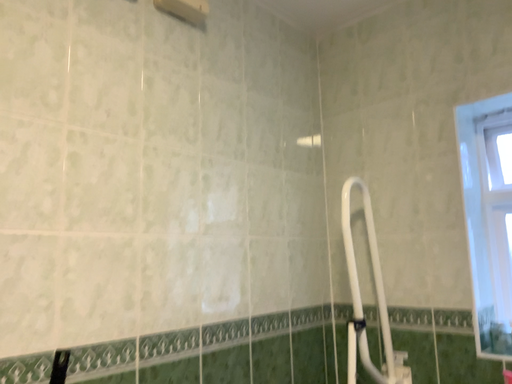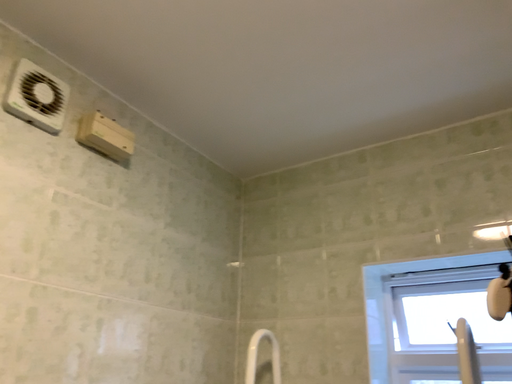
Question: How did the camera likely rotate when shooting the video?

Choices:
 (A) rotated left
 (B) rotated right

Answer: (B)